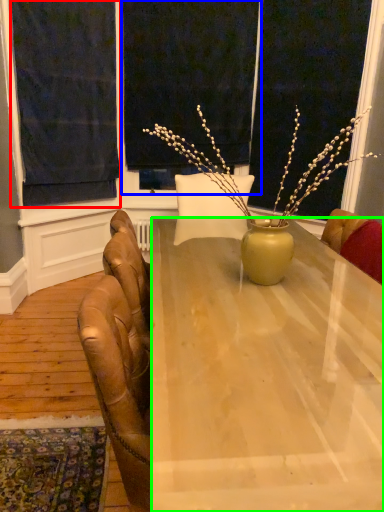
Question: Which object is positioned closest to curtain (highlighted by a red box)? Select from window screen (highlighted by a blue box) and desk (highlighted by a green box).

Choices:
 (A) window screen
 (B) desk

Answer: (A)